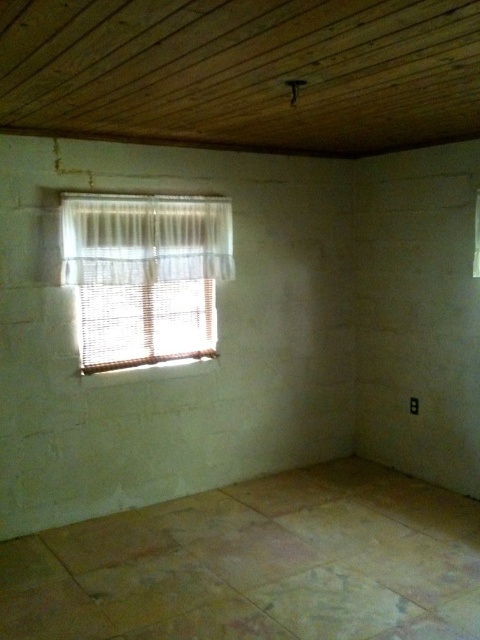
From the picture: Can you confirm if white woven blinds at left is taller than white sheer curtain at upper left?

Yes, white woven blinds at left is taller than white sheer curtain at upper left.

Is point (195, 280) positioned before point (159, 273)?

No, it is not.

The width and height of the screenshot is (480, 640). Describe the element at coordinates (144, 275) in the screenshot. I see `white woven blinds at left` at that location.

Identify the location of white woven blinds at left. (144, 275).